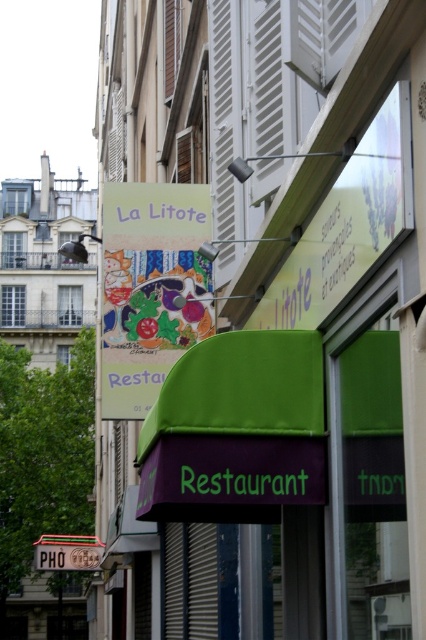
Is matte colorful signboard at center taller than metallic silver shutter at center?

Correct, matte colorful signboard at center is much taller as metallic silver shutter at center.

Is matte colorful signboard at center shorter than metallic silver shutter at center?

No, matte colorful signboard at center is not shorter than metallic silver shutter at center.

This screenshot has width=426, height=640. Describe the element at coordinates (150, 289) in the screenshot. I see `matte colorful signboard at center` at that location.

Locate an element on the screen. matte colorful signboard at center is located at coordinates (150, 289).